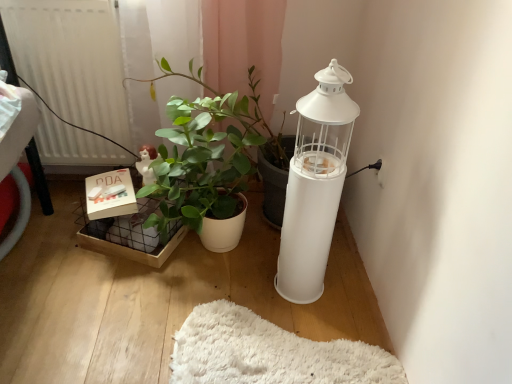
Question: In the image, is white matte radiator at left positioned in front of or behind white matte lantern at right?

Choices:
 (A) front
 (B) behind

Answer: (B)

Question: From the image's perspective, relative to white matte lantern at right, is white matte radiator at left above or below?

Choices:
 (A) below
 (B) above

Answer: (B)

Question: Based on their relative distances, which object is farther from the white matte lantern at right?

Choices:
 (A) white matte radiator at left
 (B) matte white box at lower left
 (C) matte white figurine at center-left

Answer: (A)

Question: Which is nearer to the white matte radiator at left?

Choices:
 (A) matte white figurine at center-left
 (B) white matte lantern at right
 (C) matte white box at lower left

Answer: (A)